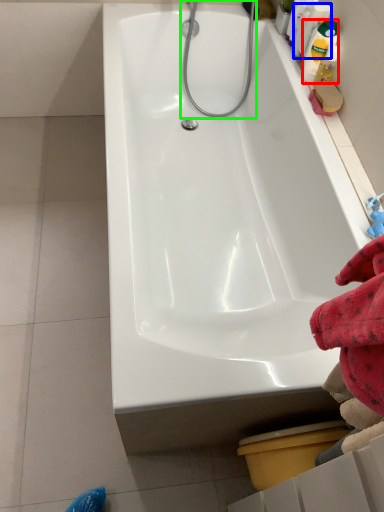
Question: Considering the real-world distances, which object is farthest from cleaning product (highlighted by a red box)? cleaning product (highlighted by a blue box) or shower (highlighted by a green box)?

Choices:
 (A) cleaning product
 (B) shower

Answer: (B)